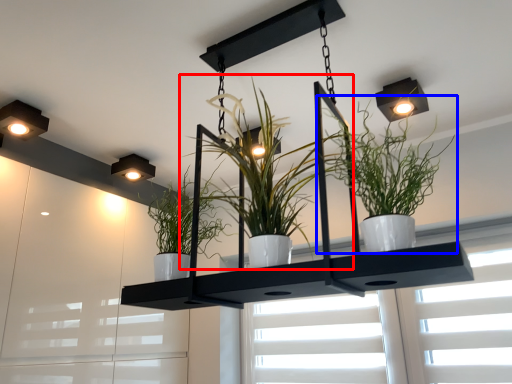
Question: Among these objects, which one is farthest to the camera, houseplant (highlighted by a red box) or houseplant (highlighted by a blue box)?

Choices:
 (A) houseplant
 (B) houseplant

Answer: (A)